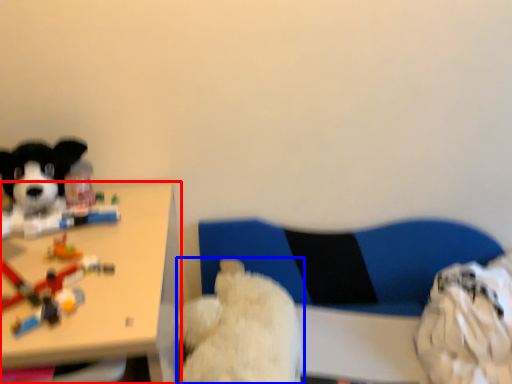
Question: Which object appears closest to the camera in this image, table (highlighted by a red box) or dog (highlighted by a blue box)?

Choices:
 (A) table
 (B) dog

Answer: (A)